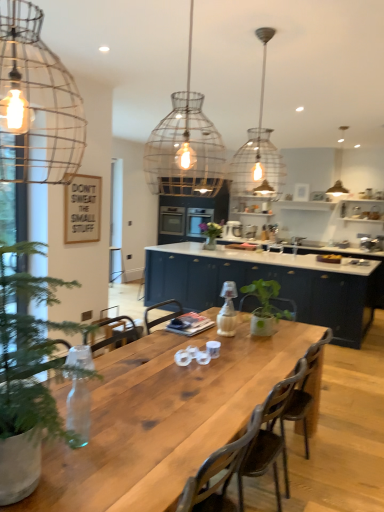
I want to click on blank space situated above natural wood table at center (from a real-world perspective), so click(176, 390).